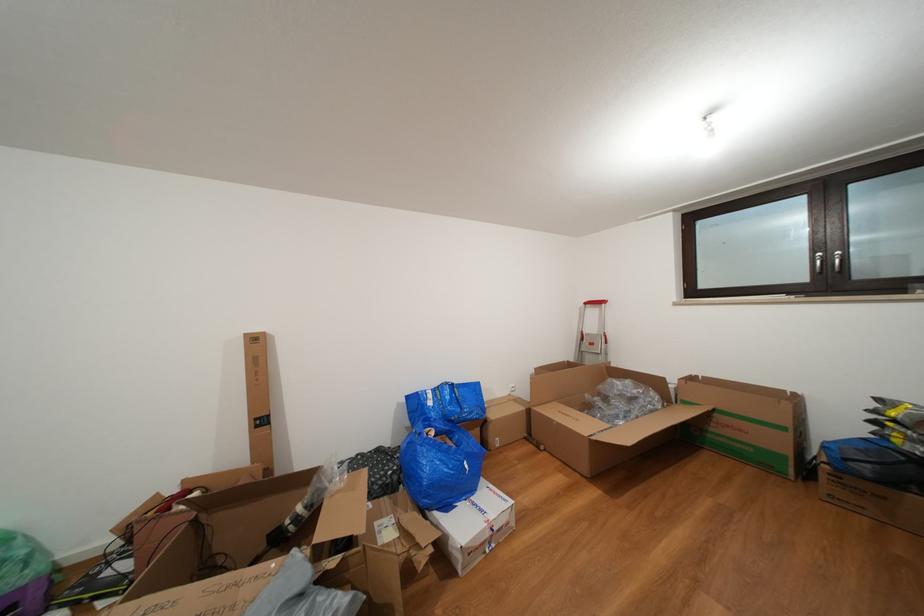
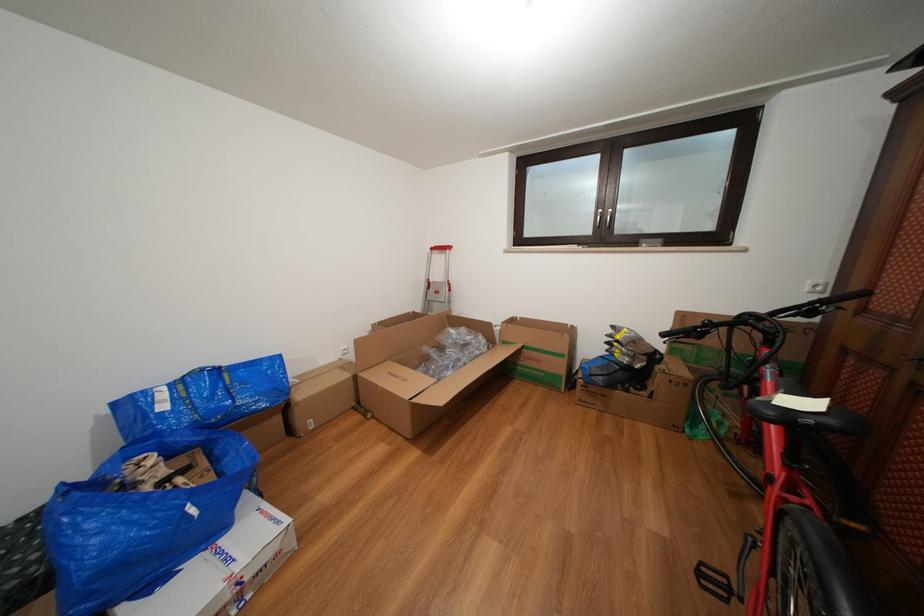
Where in the second image is the point corresponding to point (484, 424) from the first image?

(274, 414)